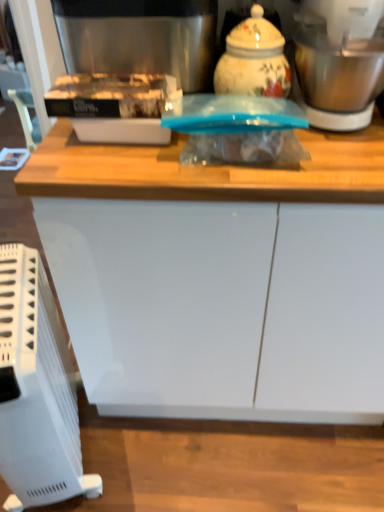
Question: Can you confirm if stainless steel blender at upper right is smaller than decorative ceramic jar at upper center?

Choices:
 (A) yes
 (B) no

Answer: (B)

Question: Is stainless steel blender at upper right positioned in front of decorative ceramic jar at upper center?

Choices:
 (A) yes
 (B) no

Answer: (A)

Question: Is stainless steel blender at upper right next to decorative ceramic jar at upper center and touching it?

Choices:
 (A) no
 (B) yes

Answer: (A)

Question: Does stainless steel blender at upper right appear on the right side of decorative ceramic jar at upper center?

Choices:
 (A) yes
 (B) no

Answer: (A)

Question: Does stainless steel blender at upper right come behind decorative ceramic jar at upper center?

Choices:
 (A) yes
 (B) no

Answer: (B)

Question: From a real-world perspective, is stainless steel blender at upper right physically below decorative ceramic jar at upper center?

Choices:
 (A) yes
 (B) no

Answer: (B)

Question: From the image's perspective, is stainless steel coffee machine at upper center below matte plastic container at upper left?

Choices:
 (A) yes
 (B) no

Answer: (B)

Question: Is stainless steel coffee machine at upper center aimed at matte plastic container at upper left?

Choices:
 (A) yes
 (B) no

Answer: (A)

Question: Is stainless steel coffee machine at upper center shorter than matte plastic container at upper left?

Choices:
 (A) yes
 (B) no

Answer: (B)

Question: Is stainless steel coffee machine at upper center outside matte plastic container at upper left?

Choices:
 (A) yes
 (B) no

Answer: (A)

Question: From a real-world perspective, is stainless steel coffee machine at upper center beneath matte plastic container at upper left?

Choices:
 (A) no
 (B) yes

Answer: (A)

Question: From the image's perspective, is stainless steel coffee machine at upper center above matte plastic container at upper left?

Choices:
 (A) yes
 (B) no

Answer: (A)

Question: From a real-world perspective, is white glossy cabinet at center physically below white plastic heater at lower left?

Choices:
 (A) yes
 (B) no

Answer: (B)